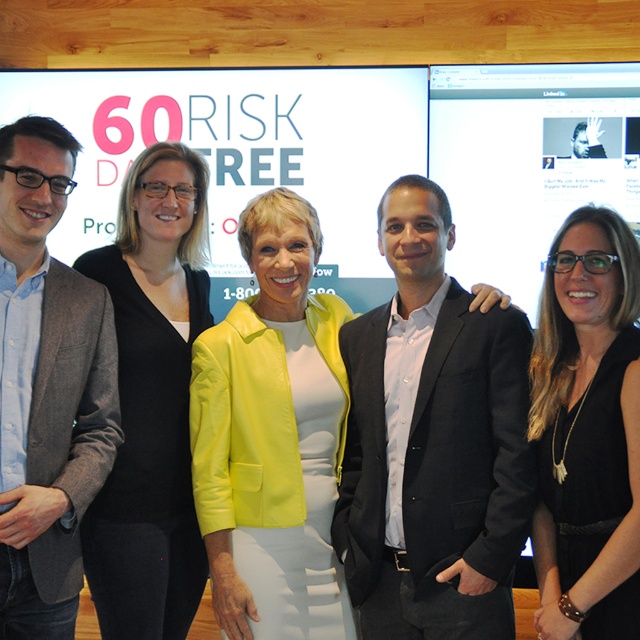
You are standing at the point labeled point (307, 435). You want to move to the other side of the room. The nearest door is 2.14 meters away. Can you reach the door without moving past the point?

The distance between you and the door is exactly 2.14 meters, so you can reach the door without moving past the point labeled point (307, 435).

You are a photographer adjusting the camera height to ensure both the black suit at center and the matte gray blazer at left are fully visible in the frame. Which clothing item requires the camera to be raised higher to capture its full length?

The matte gray blazer at left is taller than the black suit at center, so the camera should be raised higher to capture its full length.